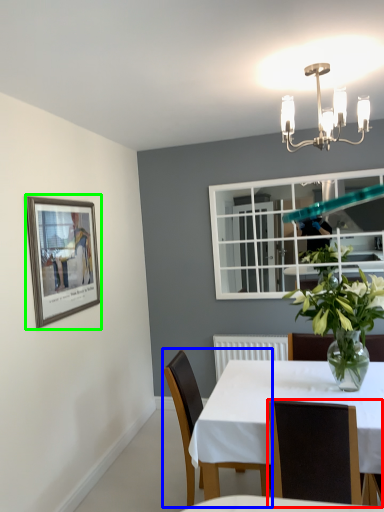
Question: Considering the real-world distances, which object is closest to chair (highlighted by a red box)? chair (highlighted by a blue box) or picture frame (highlighted by a green box).

Choices:
 (A) chair
 (B) picture frame

Answer: (A)